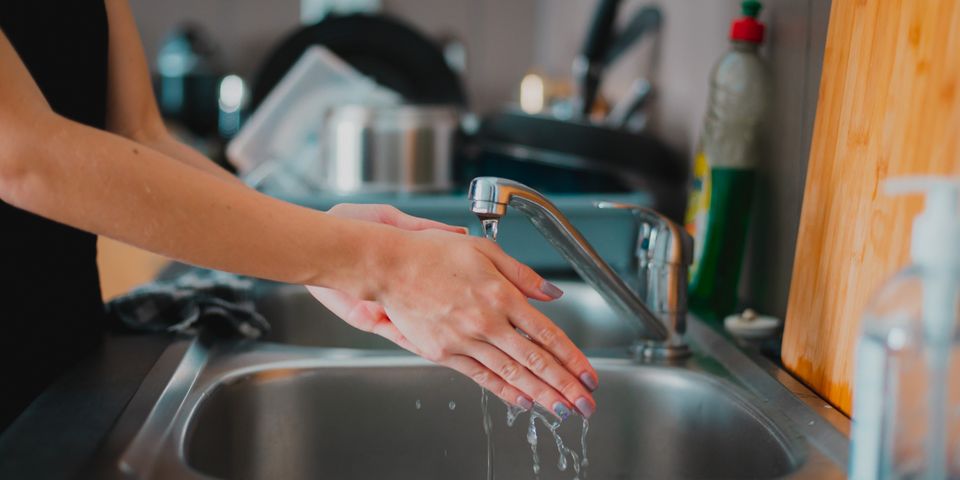
Find the location of a particular element. hand soap is located at coordinates (904, 410).